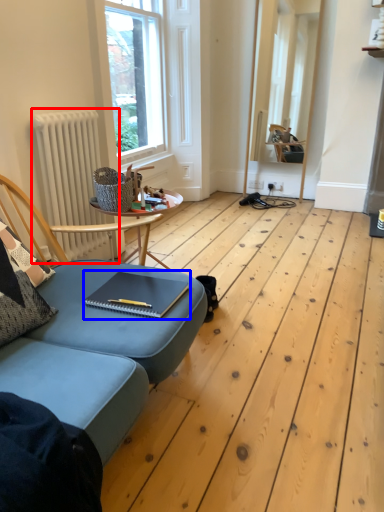
Question: Which object appears closest to the camera in this image, radiator (highlighted by a red box) or notebook (highlighted by a blue box)?

Choices:
 (A) radiator
 (B) notebook

Answer: (B)